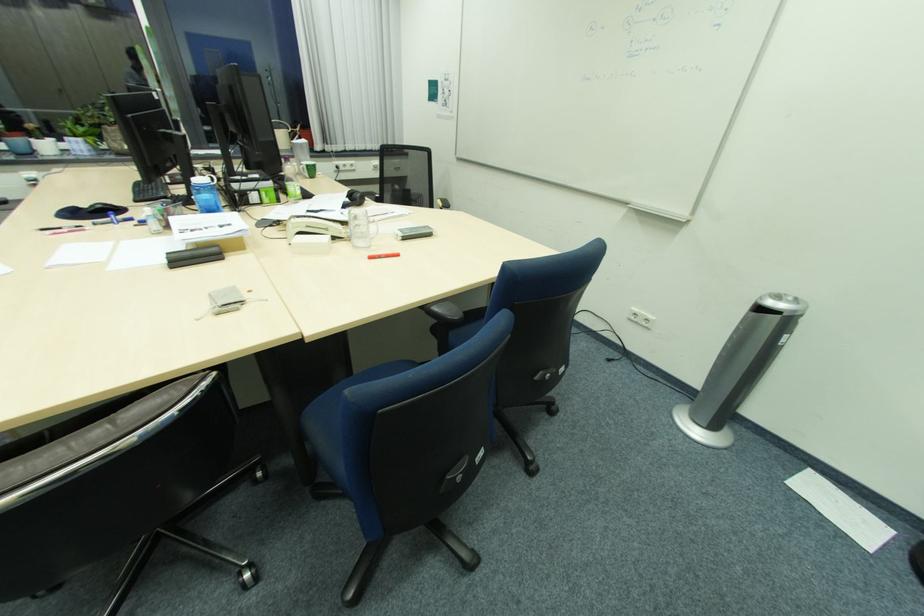
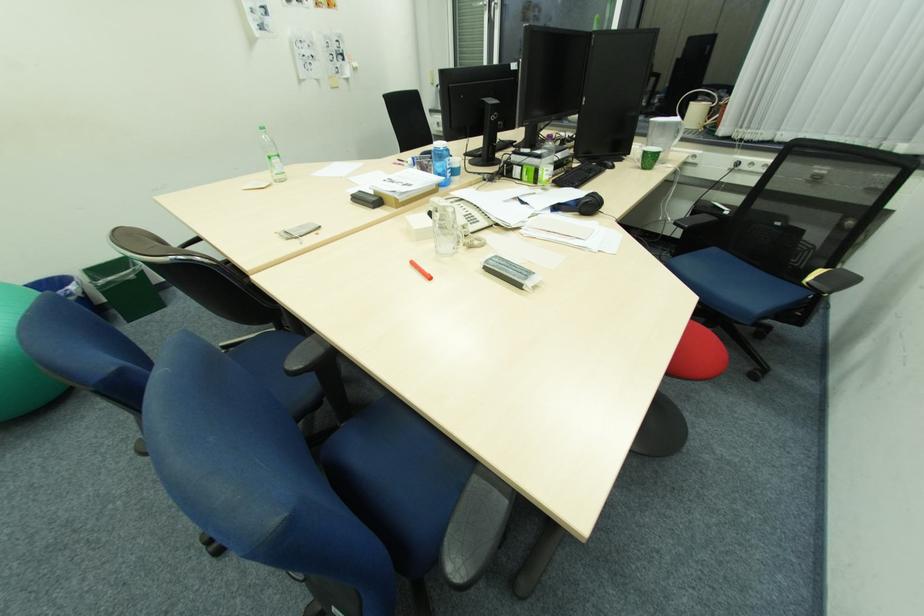
Find the pixel in the second image that matches (175,254) in the first image.

(366, 192)